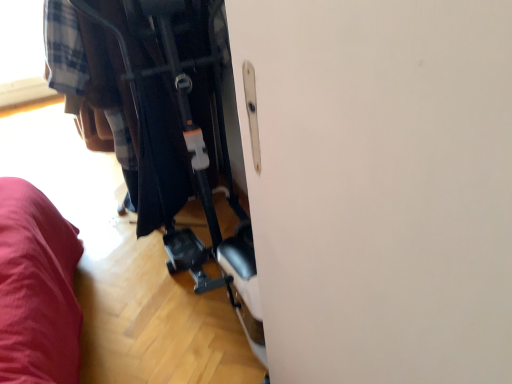
Question: From the image's perspective, would you say metallic black baby carriage at center is positioned over plaid fabric at center?

Choices:
 (A) yes
 (B) no

Answer: (B)

Question: From a real-world perspective, is metallic black baby carriage at center over plaid fabric at center?

Choices:
 (A) no
 (B) yes

Answer: (B)

Question: Considering the relative positions of metallic black baby carriage at center and plaid fabric at center in the image provided, is metallic black baby carriage at center in front of plaid fabric at center?

Choices:
 (A) yes
 (B) no

Answer: (A)

Question: Is metallic black baby carriage at center looking in the opposite direction of plaid fabric at center?

Choices:
 (A) no
 (B) yes

Answer: (A)

Question: Is metallic black baby carriage at center far from plaid fabric at center?

Choices:
 (A) no
 (B) yes

Answer: (A)

Question: Considering the relative positions of metallic black baby carriage at center and plaid fabric at center in the image provided, is metallic black baby carriage at center to the left of plaid fabric at center from the viewer's perspective?

Choices:
 (A) no
 (B) yes

Answer: (A)

Question: Is there a large distance between plaid fabric at center and metallic black baby carriage at center?

Choices:
 (A) yes
 (B) no

Answer: (B)

Question: From the image's perspective, is plaid fabric at center located above metallic black baby carriage at center?

Choices:
 (A) yes
 (B) no

Answer: (A)

Question: From a real-world perspective, is plaid fabric at center positioned under metallic black baby carriage at center based on gravity?

Choices:
 (A) no
 (B) yes

Answer: (B)

Question: From the image's perspective, is plaid fabric at center under metallic black baby carriage at center?

Choices:
 (A) no
 (B) yes

Answer: (A)

Question: Is plaid fabric at center taller than metallic black baby carriage at center?

Choices:
 (A) yes
 (B) no

Answer: (B)

Question: Can you confirm if plaid fabric at center is shorter than metallic black baby carriage at center?

Choices:
 (A) no
 (B) yes

Answer: (B)

Question: Is plaid fabric at center in front of or behind metallic black baby carriage at center in the image?

Choices:
 (A) front
 (B) behind

Answer: (B)